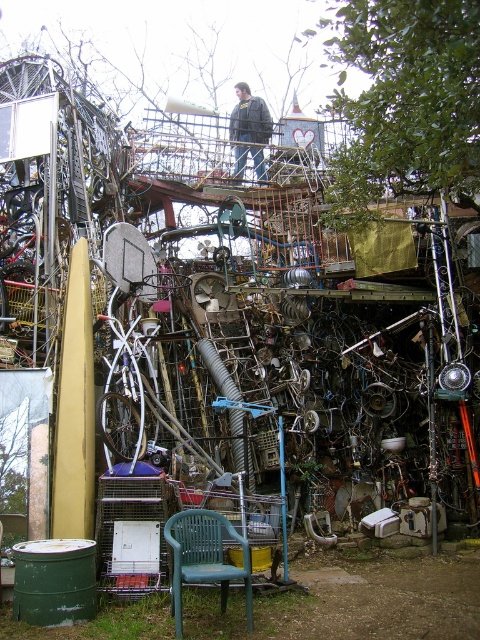
Is point (210, 577) positioned behind point (264, 168)?

No, (210, 577) is in front of (264, 168).

Who is positioned more to the left, green plastic chair at lower center or dark gray jacket at upper center?

From the viewer's perspective, green plastic chair at lower center appears more on the left side.

Does point (179, 516) lie in front of point (238, 161)?

Yes, it is.

Image resolution: width=480 pixels, height=640 pixels. Identify the location of green plastic chair at lower center. (x=204, y=557).